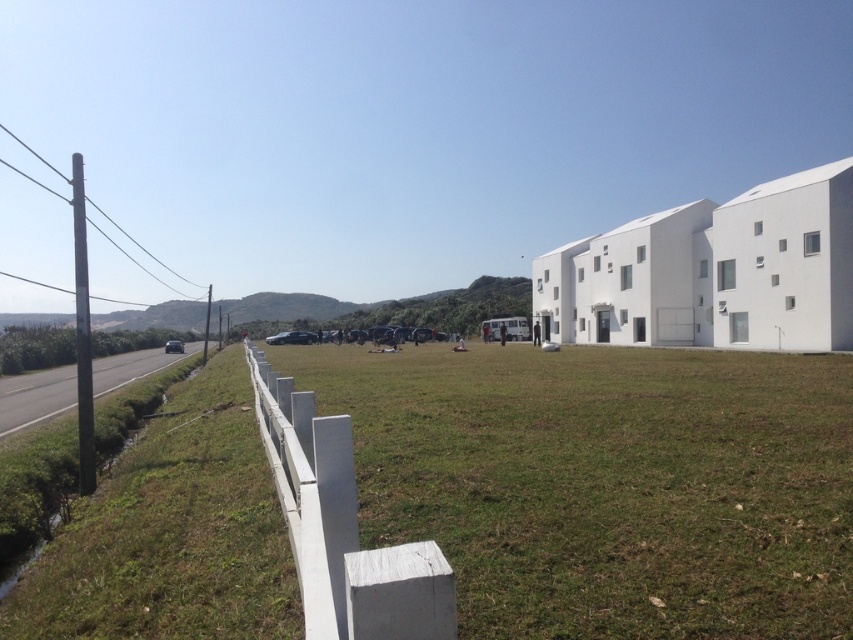
You are standing at the point marked by the coordinates point (x=607, y=483). Which surface are you standing on?

The point (x=607, y=483) is on green grass at center, so you are standing on the green grass at center.

You are standing in the middle of the road and want to walk towards the green grass at center and the white painted wood fence at center. Which one will you reach first?

The green grass at center is closer to you, so you will reach it first since it is positioned further to the viewer than the white painted wood fence at center.

You are standing at the origin point of the image coordinate system. The origin point is at the bottom left corner of the image. The coordinate system has x and y axes. The x axis goes from left to right, and the y axis goes from bottom to top. The image has a width of 1 unit and a height of 1 unit. You want to walk to the green grass at center. In which direction should you move first, left or right, and up or down?

Since the green grass at center is located at coordinate point 0.756 on the x axis and 0.713 on the y axis, and you are at the origin point at the bottom left corner, you should first move to the right along the x axis to reach the desired x coordinate of 0.756, then move upward along the y axis to reach the y coordinate of 0.713. However, since the question asks for the first direction to move, you should move right first because the x coordinate needs to be increased from 0 to 0.756 before adjusting the y